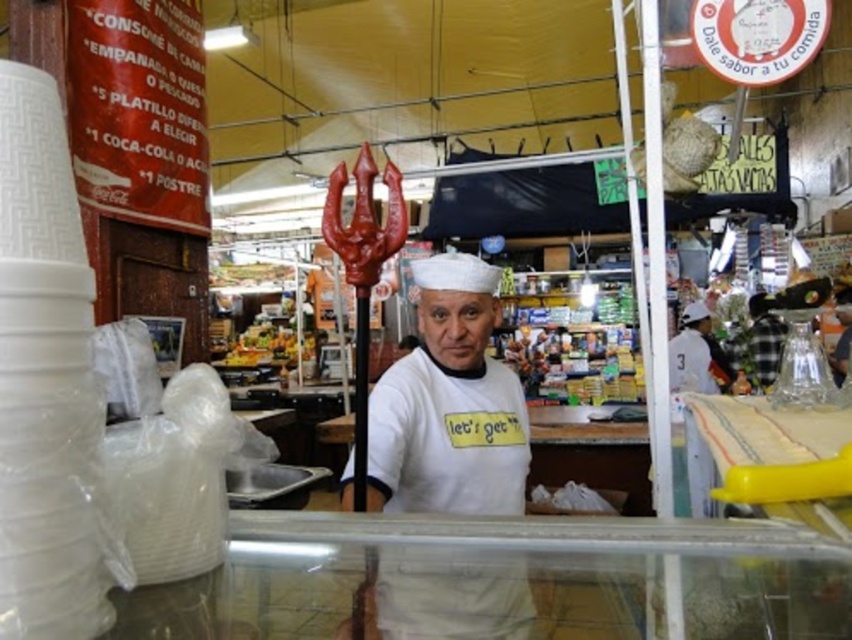
Between white matte chef hat at center and shiny plastic fruits at center, which one has less height?

shiny plastic fruits at center

Is white matte chef hat at center shorter than shiny plastic fruits at center?

No, white matte chef hat at center is not shorter than shiny plastic fruits at center.

Find the location of a particular element. This screenshot has width=852, height=640. white matte chef hat at center is located at coordinates (448, 404).

Where is `white matte chef hat at center`? white matte chef hat at center is located at coordinates (448, 404).